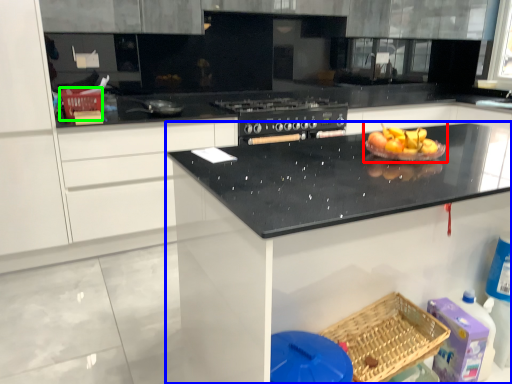
Question: Considering the real-world distances, which object is closest to fruit dish (highlighted by a red box)? countertop (highlighted by a blue box) or basket (highlighted by a green box).

Choices:
 (A) countertop
 (B) basket

Answer: (A)